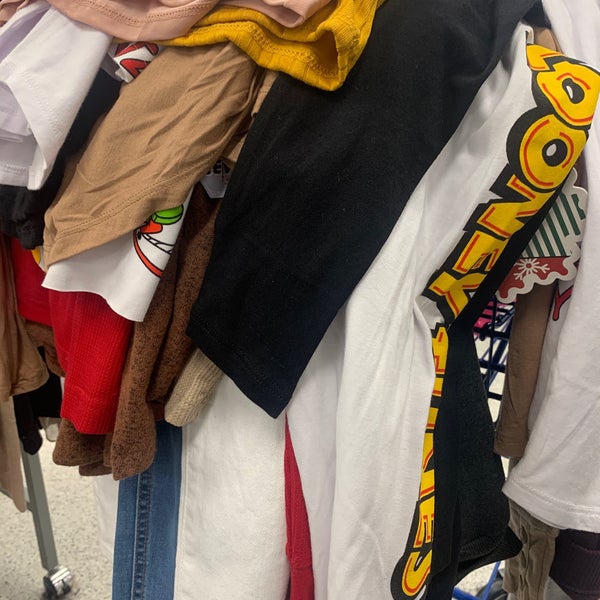
Where is `rack leg`? rack leg is located at coordinates click(60, 523), click(38, 516), click(53, 530).